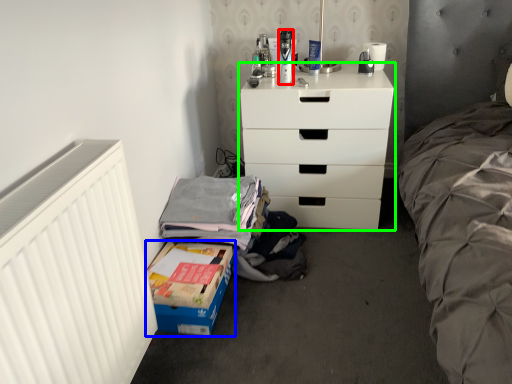
Question: Which object is positioned closest to toiletry (highlighted by a red box)? Select from box (highlighted by a blue box) and chest of drawers (highlighted by a green box).

Choices:
 (A) box
 (B) chest of drawers

Answer: (B)